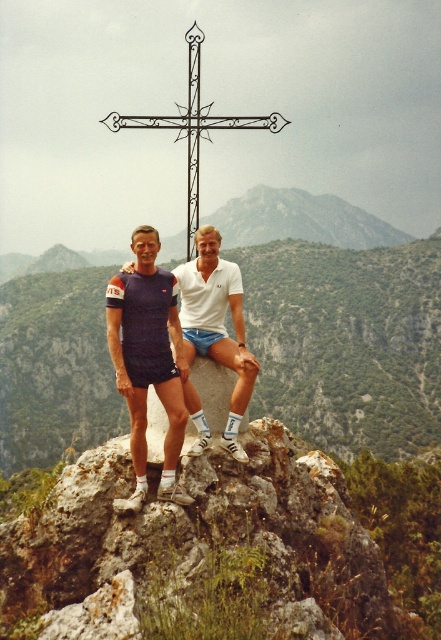
Question: Which of the following is the farthest from the observer?

Choices:
 (A) matte blue shorts at center
 (B) wrought iron cross at center

Answer: (B)

Question: Which object is positioned farthest from the matte blue shorts at center?

Choices:
 (A) wrought iron cross at center
 (B) black wrought iron cross at center
 (C) white cotton polo shirt at center

Answer: (B)

Question: Is white cotton polo shirt at center bigger than wrought iron cross at center?

Choices:
 (A) yes
 (B) no

Answer: (B)

Question: Which point is closer to the camera taking this photo?

Choices:
 (A) (219, 355)
 (B) (131, 122)
 (C) (127, 317)
 (D) (197, 115)

Answer: (A)

Question: Is matte blue shorts at center to the left of wrought iron cross at center from the viewer's perspective?

Choices:
 (A) no
 (B) yes

Answer: (B)

Question: Does white cotton polo shirt at center appear on the left side of black wrought iron cross at center?

Choices:
 (A) no
 (B) yes

Answer: (A)